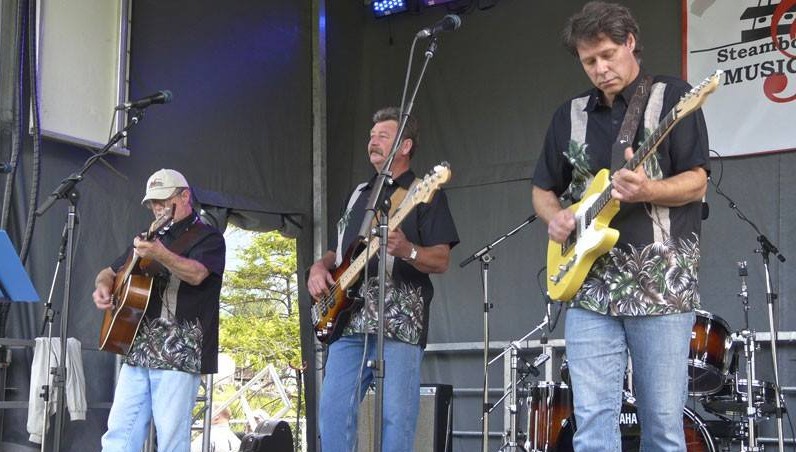
The width and height of the screenshot is (796, 452). In order to click on mic in this screenshot , I will do `click(443, 34)`.